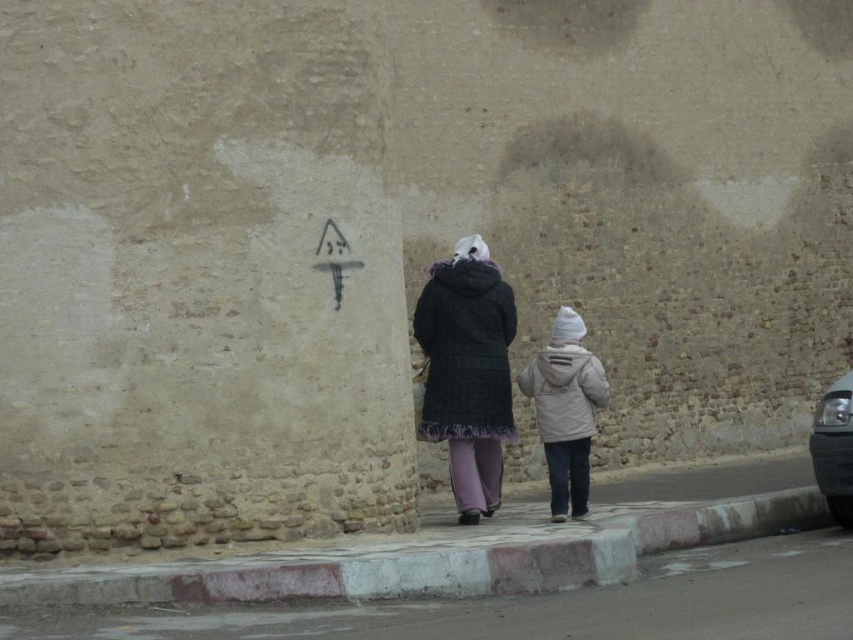
Can you confirm if smooth concrete pavement at lower center is positioned above plaid wool coat at center?

No, smooth concrete pavement at lower center is not above plaid wool coat at center.

At what (x,y) coordinates should I click in order to perform the action: click on smooth concrete pavement at lower center. Please return your answer as a coordinate pair (x, y). The width and height of the screenshot is (853, 640). Looking at the image, I should click on (537, 605).

Does plaid wool coat at center have a larger size compared to light beige fabric jacket at lower center?

Correct, plaid wool coat at center is larger in size than light beige fabric jacket at lower center.

Based on the photo, can you confirm if plaid wool coat at center is positioned to the left of light beige fabric jacket at lower center?

Correct, you'll find plaid wool coat at center to the left of light beige fabric jacket at lower center.

Between point (457, 461) and point (579, 440), which one is positioned behind?

Positioned behind is point (457, 461).

Where is `plaid wool coat at center`? Image resolution: width=853 pixels, height=640 pixels. plaid wool coat at center is located at coordinates (467, 371).

From the picture: Does smooth concrete pavement at lower center have a greater width compared to light beige fabric jacket at lower center?

Yes.

Does smooth concrete pavement at lower center have a lesser height compared to light beige fabric jacket at lower center?

Yes, smooth concrete pavement at lower center is shorter than light beige fabric jacket at lower center.

Image resolution: width=853 pixels, height=640 pixels. Identify the location of smooth concrete pavement at lower center. (537, 605).

This screenshot has height=640, width=853. I want to click on smooth concrete pavement at lower center, so click(x=537, y=605).